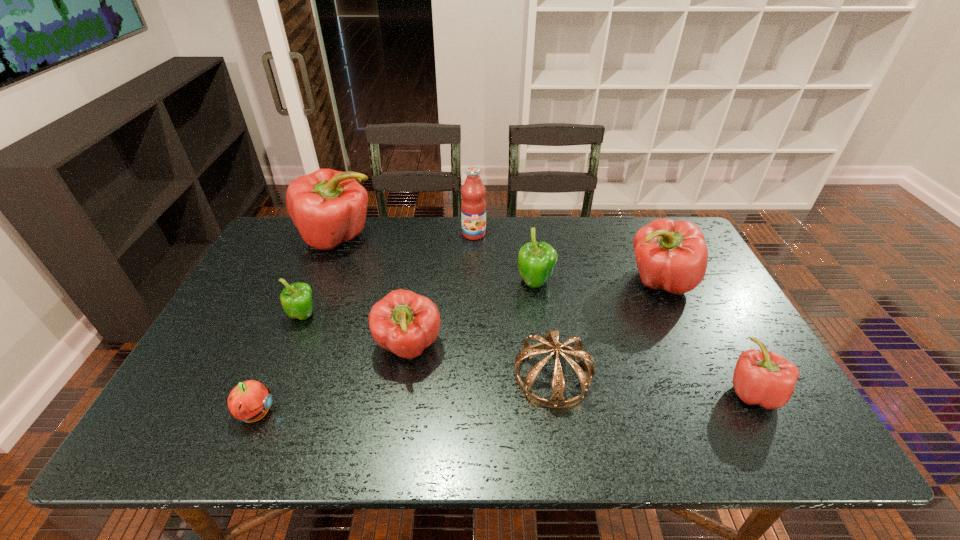
Where is `the fourth closest pink bell pepper relative to the smaller green bell pepper`? the fourth closest pink bell pepper relative to the smaller green bell pepper is located at coordinates (764, 378).

At what (x,y) coordinates should I click in order to perform the action: click on free space in the image that satisfies the following two spatial constraints: 1. on the front label of the smallest pink bell pepper; 2. on the right side of the fruit juice. Please return your answer as a coordinate pair (x, y). Looking at the image, I should click on (471, 392).

Identify the location of free spot that satisfies the following two spatial constraints: 1. on the front label of the bigger green bell pepper; 2. on the left side of the fruit juice. Image resolution: width=960 pixels, height=540 pixels. (473, 284).

Identify the location of free space that satisfies the following two spatial constraints: 1. on the front label of the brown tiara; 2. on the left side of the fruit juice. The width and height of the screenshot is (960, 540). (471, 376).

Find the location of a particular element. vacant space that satisfies the following two spatial constraints: 1. on the front side of the second pink bell pepper from left to right; 2. on the right side of the nearer green bell pepper is located at coordinates (291, 347).